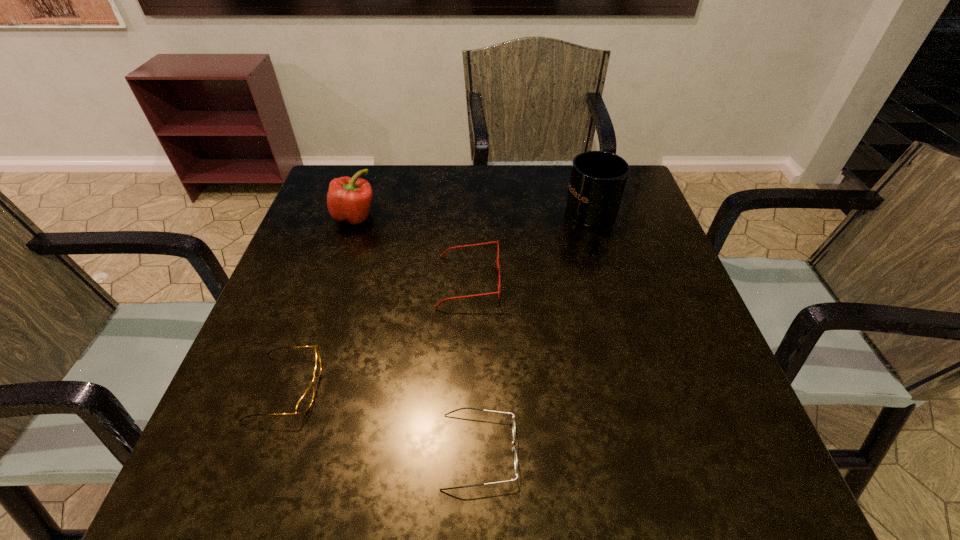
The width and height of the screenshot is (960, 540). Find the location of `object that can be found as the second closest to the mug`. object that can be found as the second closest to the mug is located at coordinates (349, 199).

The width and height of the screenshot is (960, 540). Find the location of `spectacles that is the closest one to the leftmost spectacles`. spectacles that is the closest one to the leftmost spectacles is located at coordinates (498, 269).

Locate an element on the screen. The height and width of the screenshot is (540, 960). spectacles identified as the closest to the leftmost spectacles is located at coordinates (498, 269).